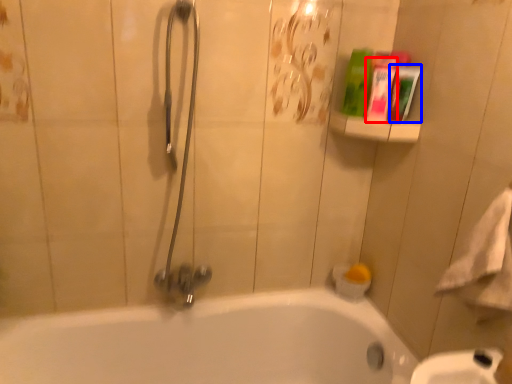
Question: Among these objects, which one is nearest to the camera, mouthwash (highlighted by a red box) or mouthwash (highlighted by a blue box)?

Choices:
 (A) mouthwash
 (B) mouthwash

Answer: (A)